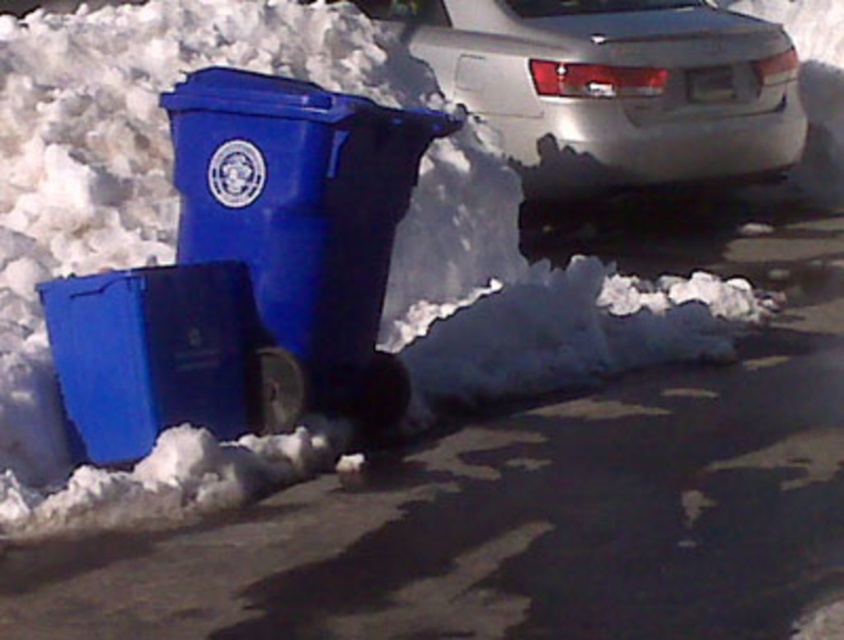
Question: Estimate the real-world distances between objects in this image. Which object is farther from the matte plastic recycling bin at left?

Choices:
 (A) silver metallic sedan at upper right
 (B) smooth asphalt at lower center

Answer: (A)

Question: Which is nearer to the matte plastic recycling bin at left?

Choices:
 (A) smooth asphalt at lower center
 (B) silver metallic sedan at upper right

Answer: (A)

Question: Does smooth asphalt at lower center appear under matte plastic recycling bin at left?

Choices:
 (A) yes
 (B) no

Answer: (A)

Question: Does smooth asphalt at lower center have a lesser width compared to matte plastic recycling bin at left?

Choices:
 (A) no
 (B) yes

Answer: (A)

Question: Which of the following is the farthest from the observer?

Choices:
 (A) (539, 60)
 (B) (215, 204)
 (C) (810, 326)

Answer: (A)

Question: Is silver metallic sedan at upper right smaller than matte plastic recycling bin at left?

Choices:
 (A) yes
 (B) no

Answer: (B)